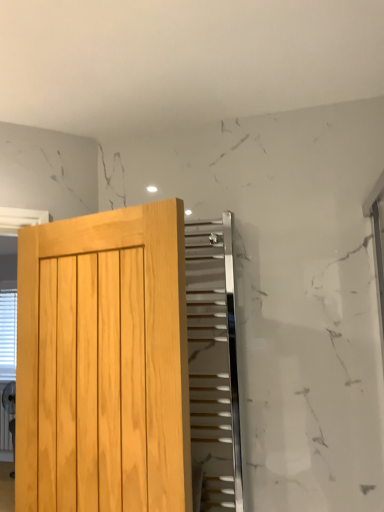
Question: From the image's perspective, is white plastic blinds at left located above polished chrome radiator at upper center?

Choices:
 (A) yes
 (B) no

Answer: (B)

Question: Does white plastic blinds at left have a lesser height compared to polished chrome radiator at upper center?

Choices:
 (A) yes
 (B) no

Answer: (B)

Question: Is the depth of white plastic blinds at left greater than that of polished chrome radiator at upper center?

Choices:
 (A) yes
 (B) no

Answer: (A)

Question: From a real-world perspective, is white plastic blinds at left positioned over polished chrome radiator at upper center based on gravity?

Choices:
 (A) no
 (B) yes

Answer: (A)

Question: Is white plastic blinds at left taller than polished chrome radiator at upper center?

Choices:
 (A) no
 (B) yes

Answer: (B)

Question: Is light wood door at left bigger or smaller than polished chrome radiator at upper center?

Choices:
 (A) small
 (B) big

Answer: (B)

Question: From the image's perspective, is light wood door at left positioned above or below polished chrome radiator at upper center?

Choices:
 (A) below
 (B) above

Answer: (B)

Question: Is point pos(86,413) closer or farther from the camera than point pos(190,306)?

Choices:
 (A) farther
 (B) closer

Answer: (B)

Question: From their relative heights in the image, would you say light wood door at left is taller or shorter than polished chrome radiator at upper center?

Choices:
 (A) tall
 (B) short

Answer: (B)

Question: Is light wood door at left wider or thinner than white plastic blinds at left?

Choices:
 (A) wide
 (B) thin

Answer: (B)

Question: Does point (77, 396) appear closer or farther from the camera than point (11, 359)?

Choices:
 (A) farther
 (B) closer

Answer: (B)

Question: From a real-world perspective, is light wood door at left physically located above or below white plastic blinds at left?

Choices:
 (A) below
 (B) above

Answer: (B)

Question: Looking at the image, does light wood door at left seem bigger or smaller compared to white plastic blinds at left?

Choices:
 (A) big
 (B) small

Answer: (B)

Question: Is point (205, 398) closer or farther from the camera than point (99, 381)?

Choices:
 (A) farther
 (B) closer

Answer: (A)

Question: From a real-world perspective, is polished chrome radiator at upper center positioned above or below light wood door at left?

Choices:
 (A) below
 (B) above

Answer: (B)